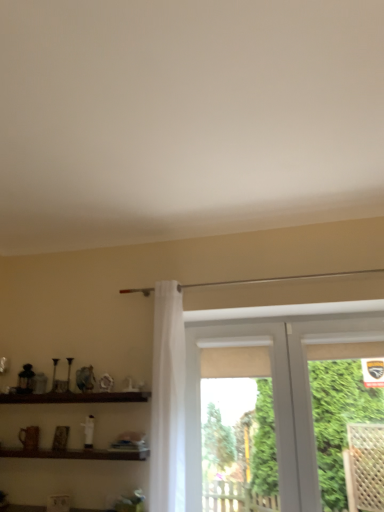
Question: Considering the relative positions of white plastic window at center and brown wooden shelf at lower left, positioned as the second shelf in bottom-to-top order, in the image provided, is white plastic window at center to the right of brown wooden shelf at lower left, positioned as the second shelf in bottom-to-top order, from the viewer's perspective?

Choices:
 (A) yes
 (B) no

Answer: (A)

Question: Considering the relative sizes of white plastic window at center and brown wooden shelf at lower left, positioned as the second shelf in bottom-to-top order, in the image provided, is white plastic window at center smaller than brown wooden shelf at lower left, positioned as the second shelf in bottom-to-top order,?

Choices:
 (A) no
 (B) yes

Answer: (A)

Question: From a real-world perspective, is white plastic window at center beneath brown wooden shelf at lower left, positioned as the second shelf in bottom-to-top order?

Choices:
 (A) yes
 (B) no

Answer: (A)

Question: Does white plastic window at center have a lesser height compared to brown wooden shelf at lower left, placed as the first shelf when sorted from top to bottom?

Choices:
 (A) no
 (B) yes

Answer: (A)

Question: Is the surface of white plastic window at center in direct contact with brown wooden shelf at lower left, placed as the first shelf when sorted from top to bottom?

Choices:
 (A) no
 (B) yes

Answer: (A)

Question: Considering the positions of brown wooden shelf at lower left, placed as the first shelf when sorted from top to bottom, and green leafy plant at right in the image, is brown wooden shelf at lower left, placed as the first shelf when sorted from top to bottom, wider or thinner than green leafy plant at right?

Choices:
 (A) wide
 (B) thin

Answer: (B)

Question: From a real-world perspective, is brown wooden shelf at lower left, positioned as the second shelf in bottom-to-top order, positioned above or below green leafy plant at right?

Choices:
 (A) below
 (B) above

Answer: (B)

Question: Considering the positions of brown wooden shelf at lower left, positioned as the second shelf in bottom-to-top order, and green leafy plant at right in the image, is brown wooden shelf at lower left, positioned as the second shelf in bottom-to-top order, taller or shorter than green leafy plant at right?

Choices:
 (A) tall
 (B) short

Answer: (B)

Question: Does point (64, 395) appear closer or farther from the camera than point (342, 394)?

Choices:
 (A) closer
 (B) farther

Answer: (B)

Question: Is green leafy plant at right in front of or behind white plastic window at center in the image?

Choices:
 (A) front
 (B) behind

Answer: (A)

Question: Choose the correct answer: Is green leafy plant at right inside white plastic window at center or outside it?

Choices:
 (A) inside
 (B) outside

Answer: (A)

Question: Is point (331, 429) positioned closer to the camera than point (291, 330)?

Choices:
 (A) closer
 (B) farther

Answer: (A)

Question: From the image's perspective, is green leafy plant at right located above or below white plastic window at center?

Choices:
 (A) above
 (B) below

Answer: (A)

Question: Is brown wooden shelf at lower left, positioned as the 1th shelf in bottom-to-top order, wider or thinner than brown wooden shelf at lower left, placed as the first shelf when sorted from top to bottom?

Choices:
 (A) wide
 (B) thin

Answer: (B)

Question: Is brown wooden shelf at lower left, the second shelf from the top, situated inside brown wooden shelf at lower left, positioned as the second shelf in bottom-to-top order, or outside?

Choices:
 (A) outside
 (B) inside

Answer: (A)